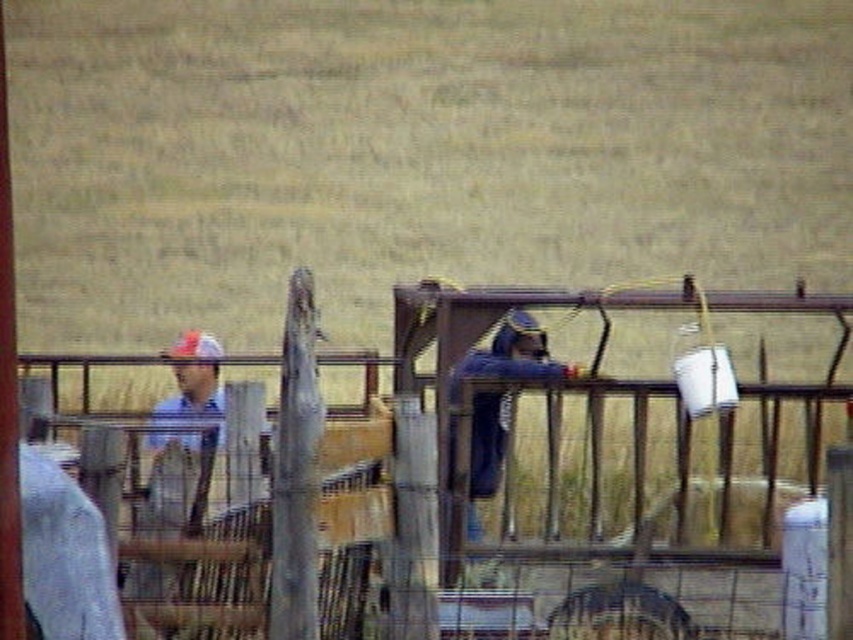
You are a painter who needs to paint the brown wooden fence at center and the blue denim shirt at left. Which object requires more horizontal space to paint?

The brown wooden fence at center requires more horizontal space to paint because its width is larger than the blue denim shirt at left.

You are standing at the point labeled as point (186,435) in the image. What color is the shirt of the person closest to you?

The point (186,435) indicates blue denim shirt at left, so the closest person has a blue denim shirt.

Looking at this image, you are standing in the rural scene looking at the wooden structure. There are two points marked on the structure. Which point is closer to you, point [172,442] or point [492,390]?

Point [172,442] is closer to the viewer than point [492,390].